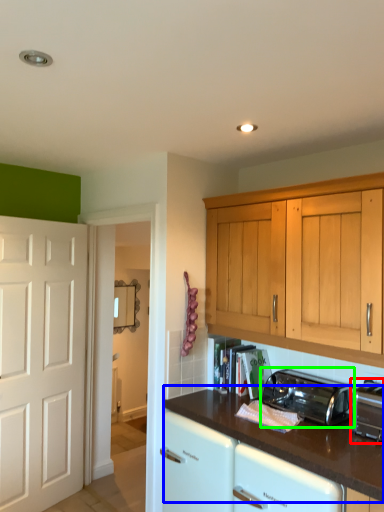
Question: Which object is positioned farthest from toaster (highlighted by a red box)? Select from countertop (highlighted by a blue box) and toaster (highlighted by a green box).

Choices:
 (A) countertop
 (B) toaster

Answer: (A)